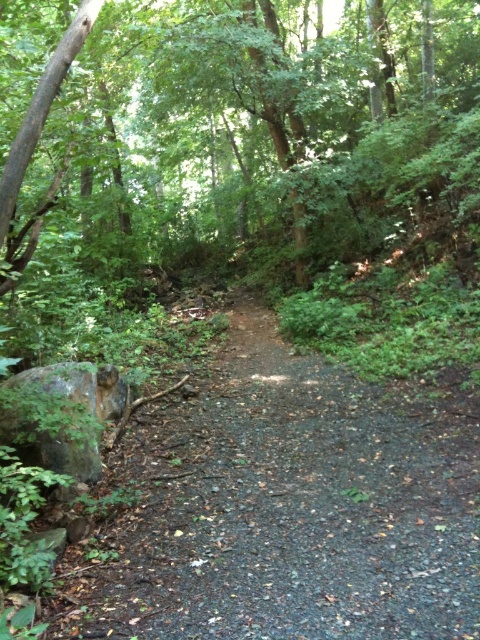
Is point (130, 550) closer to viewer compared to point (59, 429)?

No, it is behind (59, 429).

This screenshot has width=480, height=640. I want to click on dirt path at center, so click(289, 508).